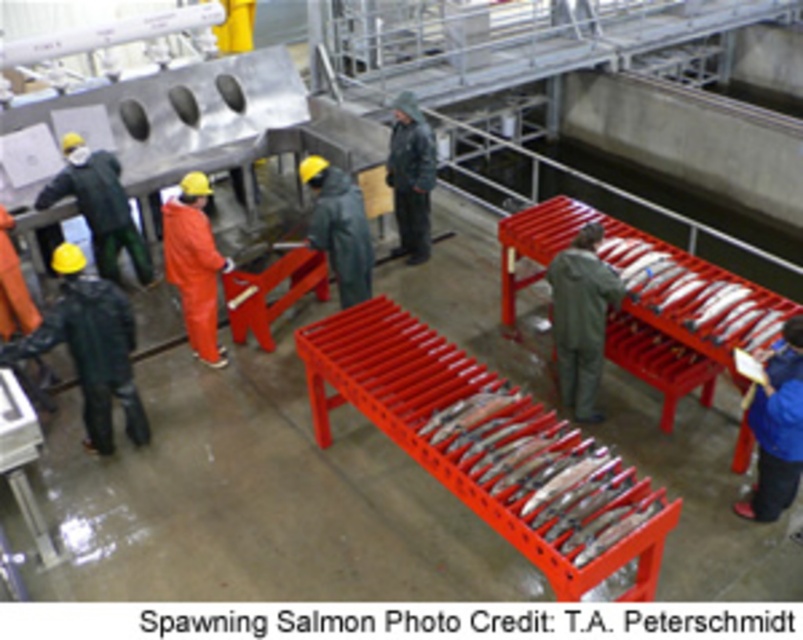
Question: Which point is closer to the camera taking this photo?

Choices:
 (A) (613, 264)
 (B) (590, 282)
 (C) (349, 234)

Answer: (B)

Question: Does green matte jacket at center have a larger size compared to dark gray waterproof jacket at center?

Choices:
 (A) yes
 (B) no

Answer: (B)

Question: Can you confirm if black rubber boots at lower left is positioned below green matte jacket at center?

Choices:
 (A) no
 (B) yes

Answer: (B)

Question: Which is farther from the green matte jumpsuit at center?

Choices:
 (A) orange matte coveralls at center
 (B) black rubber boots at lower left
 (C) blue fabric jacket at lower right

Answer: (B)

Question: Which point appears closest to the camera in this image?

Choices:
 (A) [x=502, y=433]
 (B) [x=768, y=408]

Answer: (A)

Question: Can you confirm if green matte jumpsuit at center is positioned below blue fabric jacket at lower right?

Choices:
 (A) no
 (B) yes

Answer: (A)